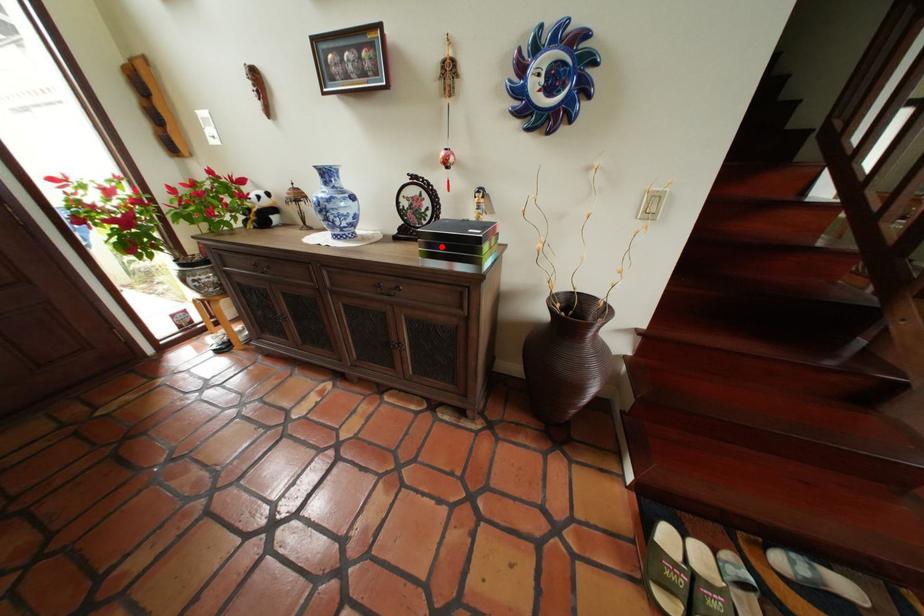
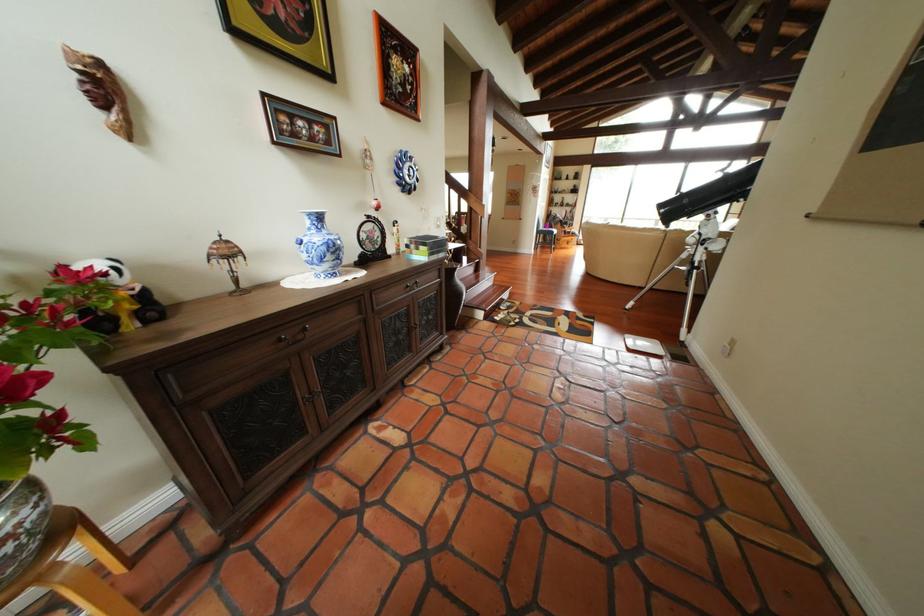
Question: I am providing you with two images of the same scene from different viewpoints. A red point is marked on the first image. Can you still see the location of the red point in image 2?

Choices:
 (A) Yes
 (B) No

Answer: (A)